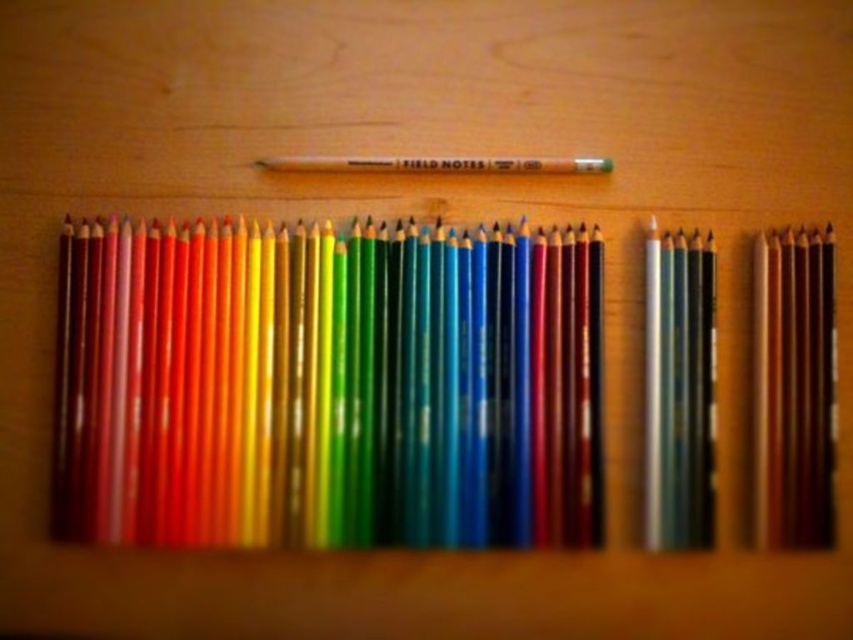
Question: Does matte wooden pencils at center appear on the left side of metallic gray pencils at right?

Choices:
 (A) no
 (B) yes

Answer: (B)

Question: Which of the following is the farthest from the observer?

Choices:
 (A) (645, 284)
 (B) (494, 296)

Answer: (A)

Question: Is matte wooden pencils at center thinner than metallic gray pencils at right?

Choices:
 (A) no
 (B) yes

Answer: (A)

Question: Is the position of matte wooden pencils at center less distant than that of metallic gray pencils at right?

Choices:
 (A) no
 (B) yes

Answer: (B)